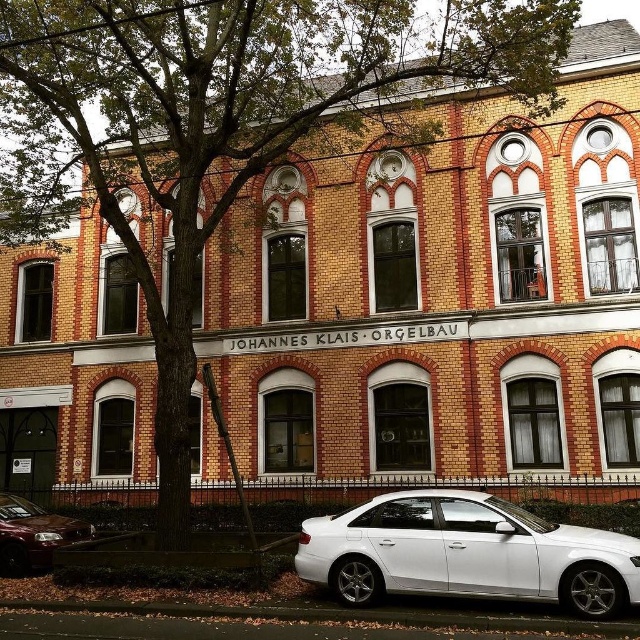
Is white glossy sedan at lower right to the left of shiny red sedan at lower left from the viewer's perspective?

No, white glossy sedan at lower right is not to the left of shiny red sedan at lower left.

Does white glossy sedan at lower right have a smaller size compared to shiny red sedan at lower left?

No, white glossy sedan at lower right is not smaller than shiny red sedan at lower left.

You are a GUI agent. You are given a task and a screenshot of the screen. Output one action in this format:
    pyautogui.click(x=<x>, y=<y>)
    Task: Click on the white glossy sedan at lower right
    This screenshot has width=640, height=640.
    Given the screenshot: What is the action you would take?
    pyautogui.click(x=467, y=554)

From the picture: Can you confirm if white glossy sedan at lower right is positioned below gray concrete curb at lower center?

No, white glossy sedan at lower right is not below gray concrete curb at lower center.

Is point (300, 564) more distant than point (336, 616)?

Yes, point (300, 564) is farther from viewer.

Between point (342, 541) and point (202, 604), which one is positioned in front?

Positioned in front is point (342, 541).

In order to click on white glossy sedan at lower right in this screenshot , I will do `click(467, 554)`.

Is gray concrete curb at lower center further to the viewer compared to shiny red sedan at lower left?

No, gray concrete curb at lower center is in front of shiny red sedan at lower left.

Can you confirm if gray concrete curb at lower center is positioned to the left of shiny red sedan at lower left?

Incorrect, gray concrete curb at lower center is not on the left side of shiny red sedan at lower left.

Where is `gray concrete curb at lower center`? The height and width of the screenshot is (640, 640). gray concrete curb at lower center is located at coordinates (324, 616).